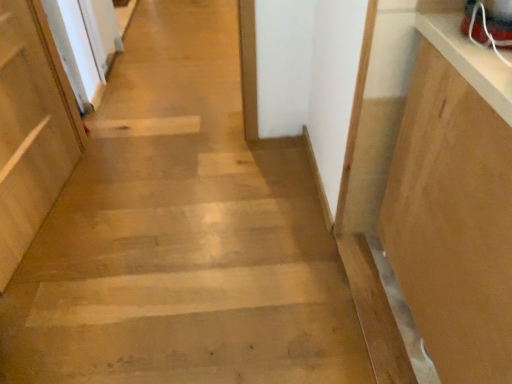
What do you see at coordinates (31, 128) in the screenshot?
I see `matte wood door at left` at bounding box center [31, 128].

This screenshot has width=512, height=384. I want to click on matte wood door at left, so click(31, 128).

The width and height of the screenshot is (512, 384). What do you see at coordinates (453, 222) in the screenshot?
I see `light brown wood cabinet at right` at bounding box center [453, 222].

What is the approximate width of light brown wood cabinet at right?

light brown wood cabinet at right is 19.67 inches wide.

Identify the location of light brown wood cabinet at right. (453, 222).

The image size is (512, 384). I want to click on matte wood door at left, so click(x=31, y=128).

In the image, is light brown wood cabinet at right on the left side or the right side of matte wood door at left?

Clearly, light brown wood cabinet at right is on the right of matte wood door at left in the image.

In the image, is light brown wood cabinet at right positioned in front of or behind matte wood door at left?

Clearly, light brown wood cabinet at right is in front of matte wood door at left.

Which point is more forward, (479, 302) or (27, 137)?

Point (479, 302)

From the image's perspective, is light brown wood cabinet at right positioned above or below matte wood door at left?

Clearly, from the image's perspective, light brown wood cabinet at right is below matte wood door at left.

From the picture: From a real-world perspective, is light brown wood cabinet at right on top of matte wood door at left?

Yes.

Considering the relative sizes of light brown wood cabinet at right and matte wood door at left in the image provided, is light brown wood cabinet at right wider than matte wood door at left?

Indeed, light brown wood cabinet at right has a greater width compared to matte wood door at left.

From their relative heights in the image, would you say light brown wood cabinet at right is taller or shorter than matte wood door at left?

Clearly, light brown wood cabinet at right is taller compared to matte wood door at left.

Considering the relative sizes of light brown wood cabinet at right and matte wood door at left in the image provided, is light brown wood cabinet at right bigger than matte wood door at left?

Yes, light brown wood cabinet at right is bigger than matte wood door at left.

Consider the image. Would you say light brown wood cabinet at right is outside matte wood door at left?

Yes.

Are light brown wood cabinet at right and matte wood door at left making contact?

No, light brown wood cabinet at right is not in contact with matte wood door at left.

Could you tell me if light brown wood cabinet at right is turned towards matte wood door at left?

No, light brown wood cabinet at right is not facing towards matte wood door at left.

Can you tell me how much light brown wood cabinet at right and matte wood door at left differ in facing direction?

light brown wood cabinet at right and matte wood door at left are facing 7.02 degrees away from each other.

What are the coordinates of `cabinetry lying below the matte wood door at left (from the image's perspective)` in the screenshot? It's located at (453, 222).

Does matte wood door at left appear on the left side of light brown wood cabinet at right?

Yes, matte wood door at left is to the left of light brown wood cabinet at right.

Is the depth of matte wood door at left greater than that of light brown wood cabinet at right?

Yes, matte wood door at left is further from the viewer.

Considering the positions of points (23, 170) and (456, 226), is point (23, 170) farther from camera compared to point (456, 226)?

Yes, point (23, 170) is behind point (456, 226).

From the image's perspective, which one is positioned higher, matte wood door at left or light brown wood cabinet at right?

matte wood door at left, from the image's perspective.

From a real-world perspective, between matte wood door at left and light brown wood cabinet at right, who is vertically higher?

light brown wood cabinet at right.

Does matte wood door at left have a lesser width compared to light brown wood cabinet at right?

Indeed, matte wood door at left has a lesser width compared to light brown wood cabinet at right.

Between matte wood door at left and light brown wood cabinet at right, which one has less height?

With less height is matte wood door at left.

Is matte wood door at left bigger or smaller than light brown wood cabinet at right?

In the image, matte wood door at left appears to be smaller than light brown wood cabinet at right.

Is matte wood door at left situated inside light brown wood cabinet at right or outside?

matte wood door at left is located beyond the bounds of light brown wood cabinet at right.

Is matte wood door at left far away from light brown wood cabinet at right?

Indeed, matte wood door at left is not near light brown wood cabinet at right.

Is matte wood door at left oriented away from light brown wood cabinet at right?

No.

Where is `cabinetry located in front of the matte wood door at left`? cabinetry located in front of the matte wood door at left is located at coordinates (453, 222).

The image size is (512, 384). In order to click on door that appears above the light brown wood cabinet at right (from the image's perspective) in this screenshot , I will do `click(31, 128)`.

At what (x,y) coordinates should I click in order to perform the action: click on cabinetry below the matte wood door at left (from the image's perspective). Please return your answer as a coordinate pair (x, y). The height and width of the screenshot is (384, 512). Looking at the image, I should click on click(453, 222).